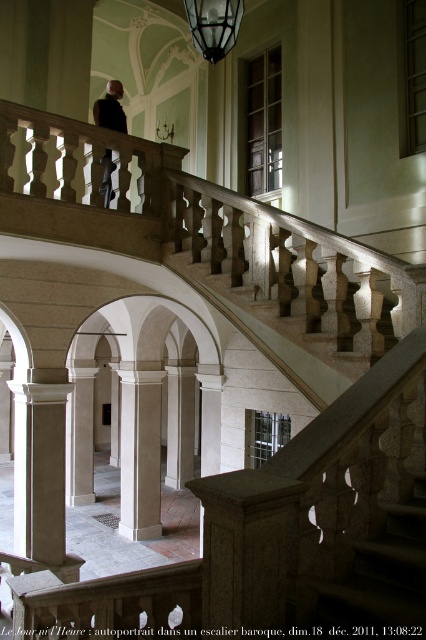
Question: Which object appears farthest from the camera in this image?

Choices:
 (A) white stone column at center
 (B) dark gray suit at upper center

Answer: (A)

Question: Can you confirm if matte glass lamp at upper center is thinner than dark gray suit at upper center?

Choices:
 (A) no
 (B) yes

Answer: (B)

Question: Is matte glass lamp at upper center closer to the viewer compared to dark gray suit at upper center?

Choices:
 (A) yes
 (B) no

Answer: (A)

Question: Which point is farther from the camera taking this photo?

Choices:
 (A) (155, 435)
 (B) (201, 42)
 (C) (95, 104)

Answer: (A)

Question: Considering the relative positions of white stone column at center and dark gray suit at upper center in the image provided, where is white stone column at center located with respect to dark gray suit at upper center?

Choices:
 (A) below
 (B) above

Answer: (A)

Question: Which is nearer to the dark gray suit at upper center?

Choices:
 (A) white stone column at center
 (B) matte glass lamp at upper center

Answer: (B)